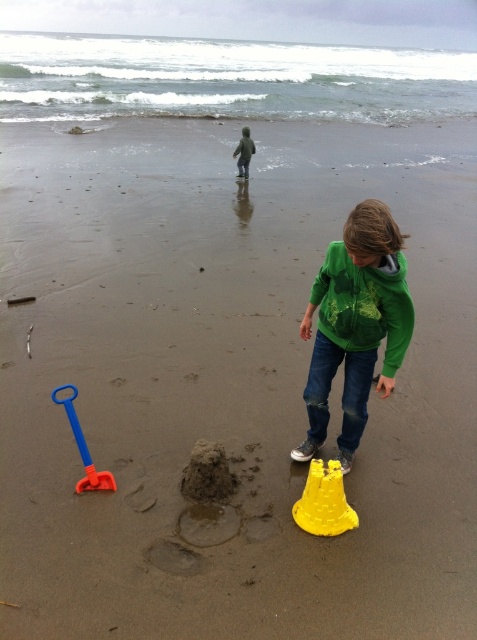
What do you see at coordinates (355, 324) in the screenshot?
I see `green matte hoodie at center` at bounding box center [355, 324].

Looking at this image, which is below, green matte hoodie at center or yellow plastic bucket at lower center?

yellow plastic bucket at lower center

The width and height of the screenshot is (477, 640). Identify the location of green matte hoodie at center. coord(355,324).

Is green matte jacket at lower right positioned behind blue plastic shovel at lower left?

No, it is not.

Describe the element at coordinates (364, 305) in the screenshot. I see `green matte jacket at lower right` at that location.

Is point (394, 260) farther from viewer compared to point (82, 481)?

No, it is not.

Identify the location of green matte jacket at lower right. (364, 305).

Who is shorter, yellow plastic bucket at lower center or blue plastic shovel at lower left?

yellow plastic bucket at lower center

Who is lower down, yellow plastic bucket at lower center or blue plastic shovel at lower left?

yellow plastic bucket at lower center is below.

Where is `yellow plastic bucket at lower center`? yellow plastic bucket at lower center is located at coordinates (323, 500).